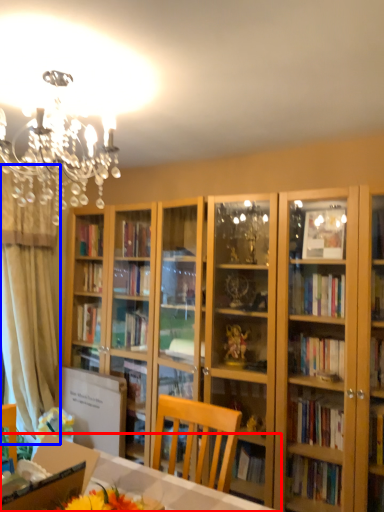
Question: Which point is closer to the camera, desk (highlighted by a red box) or curtain (highlighted by a blue box)?

Choices:
 (A) desk
 (B) curtain

Answer: (A)